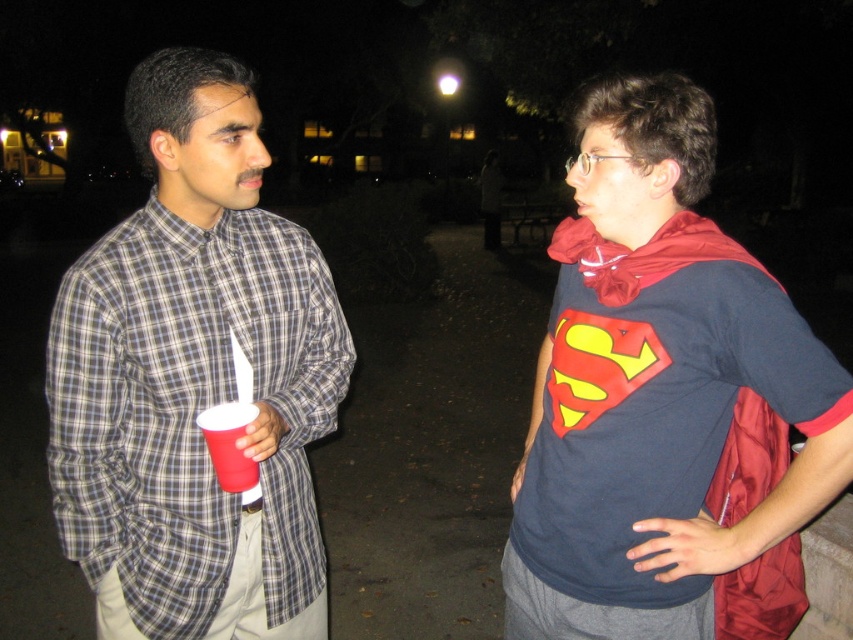
Question: Which object appears farthest from the camera in this image?

Choices:
 (A) matte plastic cup at left
 (B) red fabric cape at center

Answer: (A)

Question: Is red fabric cape at center positioned before plaid shirt at center?

Choices:
 (A) no
 (B) yes

Answer: (B)

Question: Considering the real-world distances, which object is farthest from the red fabric cape at center?

Choices:
 (A) plaid shirt at center
 (B) matte plastic cup at left

Answer: (B)

Question: Is plaid shirt at center to the right of matte plastic cup at left from the viewer's perspective?

Choices:
 (A) no
 (B) yes

Answer: (A)

Question: Where is red fabric cape at center located in relation to matte plastic cup at left in the image?

Choices:
 (A) above
 (B) below

Answer: (A)

Question: Considering the real-world distances, which object is closest to the plaid shirt at center?

Choices:
 (A) red fabric cape at center
 (B) matte plastic cup at left

Answer: (B)